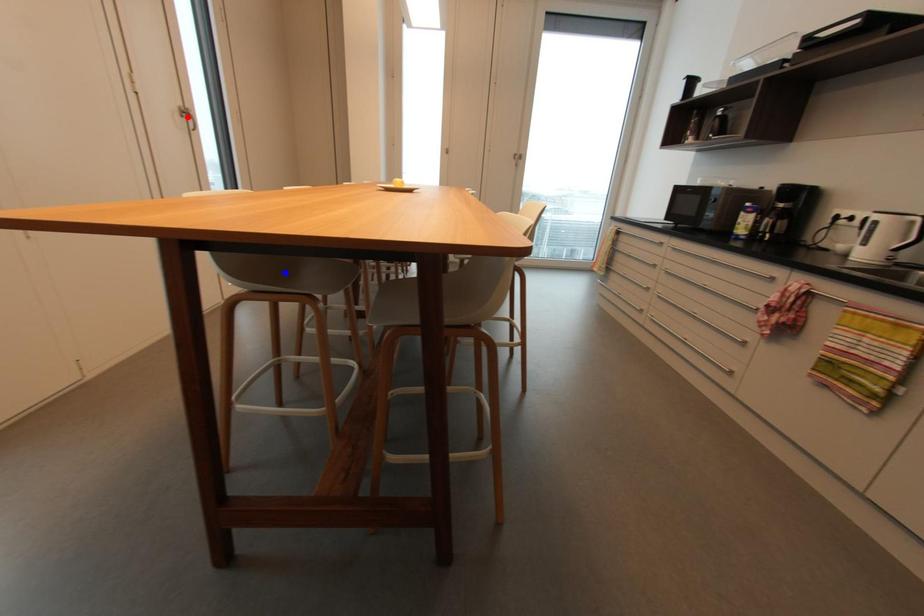
Question: In the image, two points are highlighted. Which point is nearer to the camera? Reply with the corresponding letter.

Choices:
 (A) blue point
 (B) red point

Answer: (A)